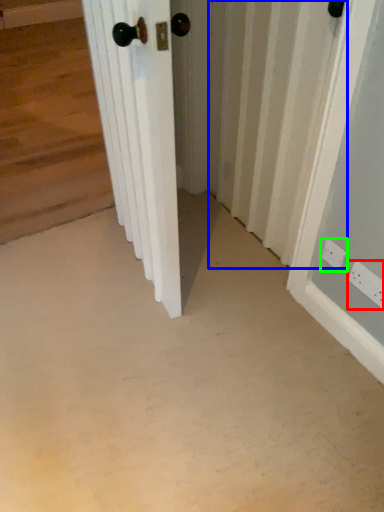
Question: Which object is positioned closest to electric outlet (highlighted by a red box)? Select from radiator (highlighted by a blue box) and electric outlet (highlighted by a green box).

Choices:
 (A) radiator
 (B) electric outlet

Answer: (B)